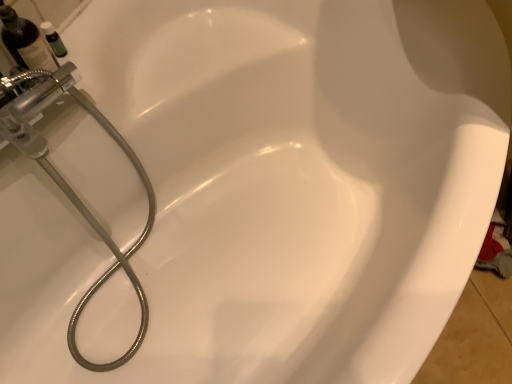
Question: Relative to matte black bottle at upper left, is brushed metal showerhead at left in front or behind?

Choices:
 (A) front
 (B) behind

Answer: (A)

Question: Considering the relative positions of brushed metal showerhead at left and matte black bottle at upper left in the image provided, is brushed metal showerhead at left to the left or to the right of matte black bottle at upper left?

Choices:
 (A) left
 (B) right

Answer: (B)

Question: Which of these objects is positioned closest to the brushed metal showerhead at left?

Choices:
 (A) green glass bottle at upper left
 (B) matte black bottle at upper left

Answer: (B)

Question: Based on their relative distances, which object is nearer to the green glass bottle at upper left?

Choices:
 (A) brushed metal showerhead at left
 (B) matte black bottle at upper left

Answer: (B)